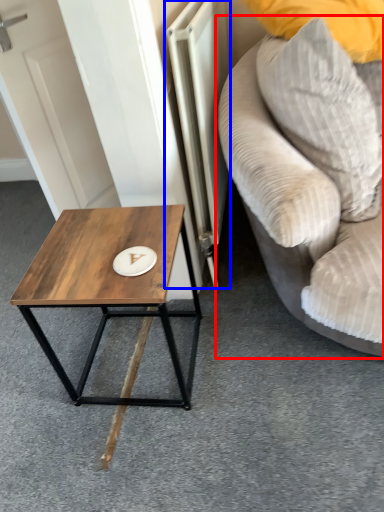
Question: Which point is closer to the camera, studio couch (highlighted by a red box) or radiator (highlighted by a blue box)?

Choices:
 (A) studio couch
 (B) radiator

Answer: (A)